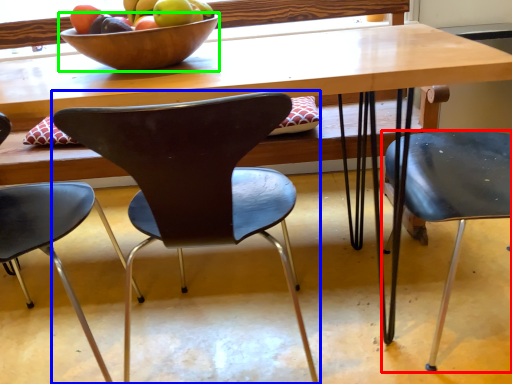
Question: Estimate the real-world distances between objects in this image. Which object is closer to chair (highlighted by a red box), chair (highlighted by a blue box) or bowl (highlighted by a green box)?

Choices:
 (A) chair
 (B) bowl

Answer: (A)